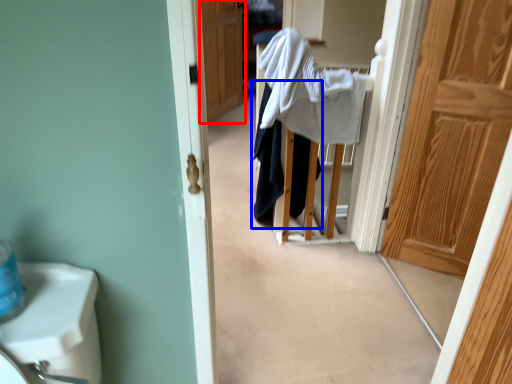
Question: Which point is further to the camera, door (highlighted by a red box) or clothing (highlighted by a blue box)?

Choices:
 (A) door
 (B) clothing

Answer: (A)